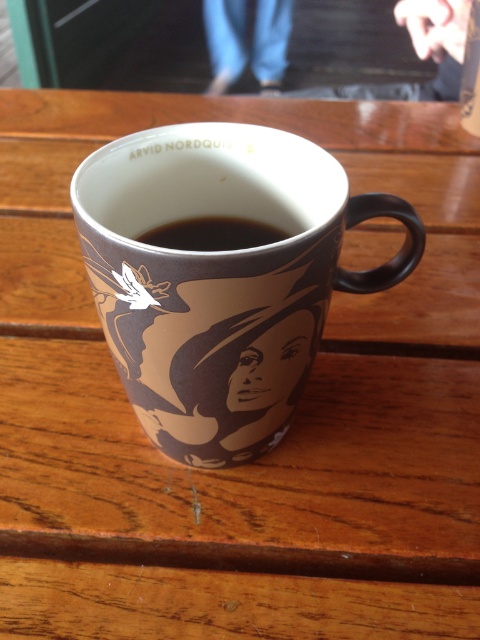
Who is more forward, [97,202] or [274,237]?

Point [97,202]

Who is more distant from viewer, [242,342] or [201,230]?

Positioned behind is point [201,230].

This screenshot has width=480, height=640. In order to click on brown matte mug at center in this screenshot , I will do `click(222, 276)`.

Is black glossy coffee at center positioned behind black glossy coffee cup at center?

No, it is not.

Is black glossy coffee at center wider than black glossy coffee cup at center?

Yes, black glossy coffee at center is wider than black glossy coffee cup at center.

What do you see at coordinates (212, 234) in the screenshot?
I see `black glossy coffee at center` at bounding box center [212, 234].

Image resolution: width=480 pixels, height=640 pixels. Identify the location of black glossy coffee at center. (212, 234).

Is brown matte mug at center to the right of black glossy coffee cup at center from the viewer's perspective?

No, brown matte mug at center is not to the right of black glossy coffee cup at center.

Can you confirm if brown matte mug at center is smaller than black glossy coffee cup at center?

Incorrect, brown matte mug at center is not smaller in size than black glossy coffee cup at center.

Locate an element on the screen. Image resolution: width=480 pixels, height=640 pixels. brown matte mug at center is located at coordinates (222, 276).